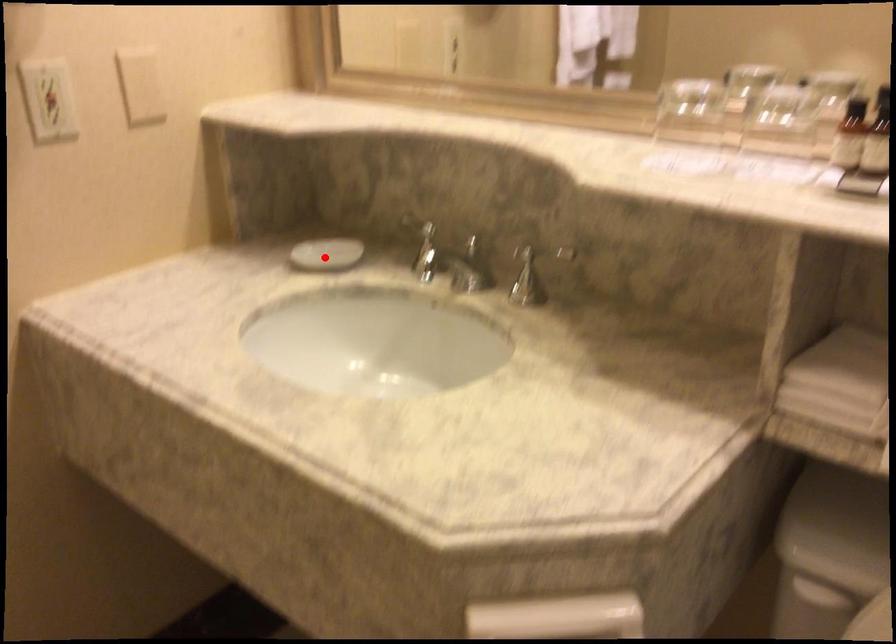
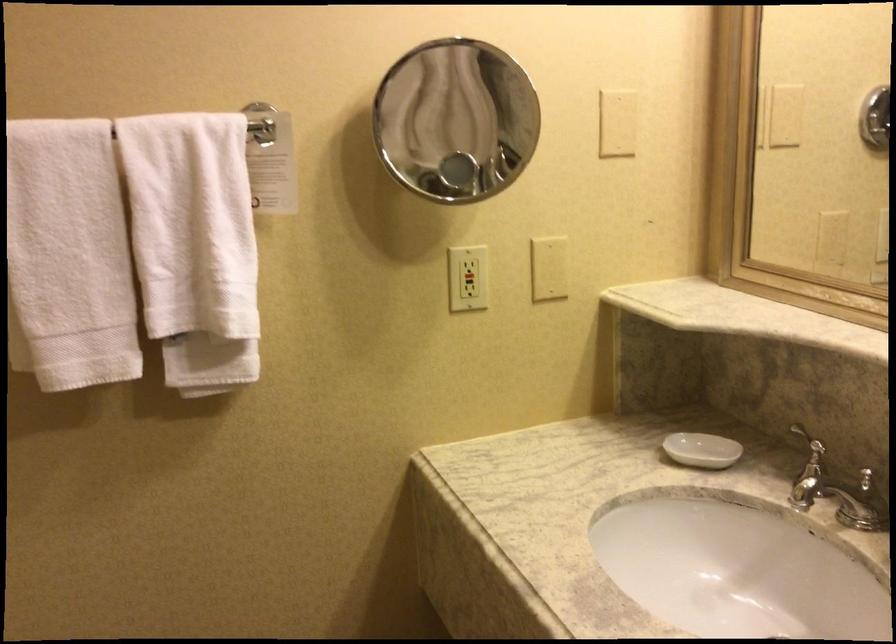
Locate, in the second image, the point that corresponds to the highlighted location in the first image.

(702, 450)